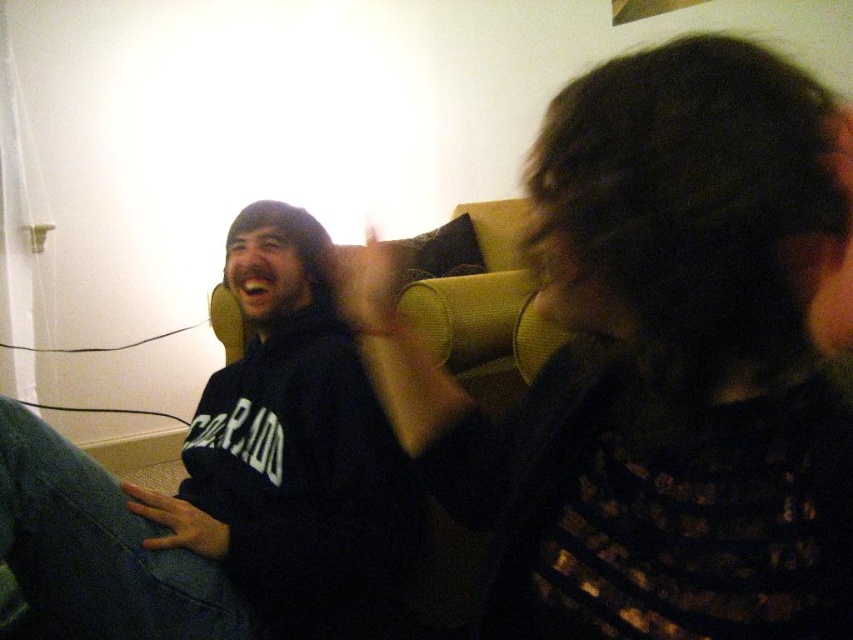
You are a photographer trying to capture a candid shot of the two people in the scene. You want to ensure that both the dark textured hair at upper right and the black matte sweatshirt at left are in focus simultaneously. Given that your camera has a depth of field that can cover 20 inches, will you need to adjust your settings to include both subjects?

The dark textured hair at upper right and the black matte sweatshirt at left are 22.04 inches apart. Since the depth of field can only cover 20 inches, you will need to adjust your camera settings to ensure both are in focus.

Based on the photo, what are the coordinates of the dark textured hair at upper right?

The dark textured hair at upper right is located at point (660, 362).